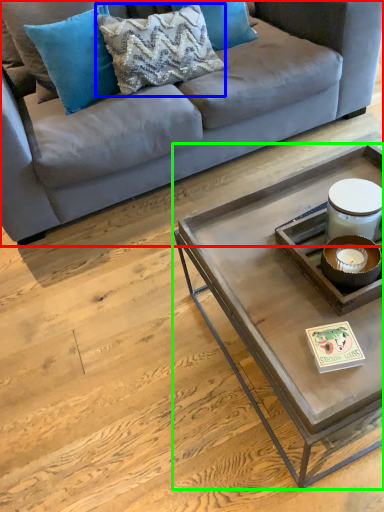
Question: Considering the real-world distances, which object is closest to studio couch (highlighted by a red box)? pillow (highlighted by a blue box) or coffee table (highlighted by a green box).

Choices:
 (A) pillow
 (B) coffee table

Answer: (A)